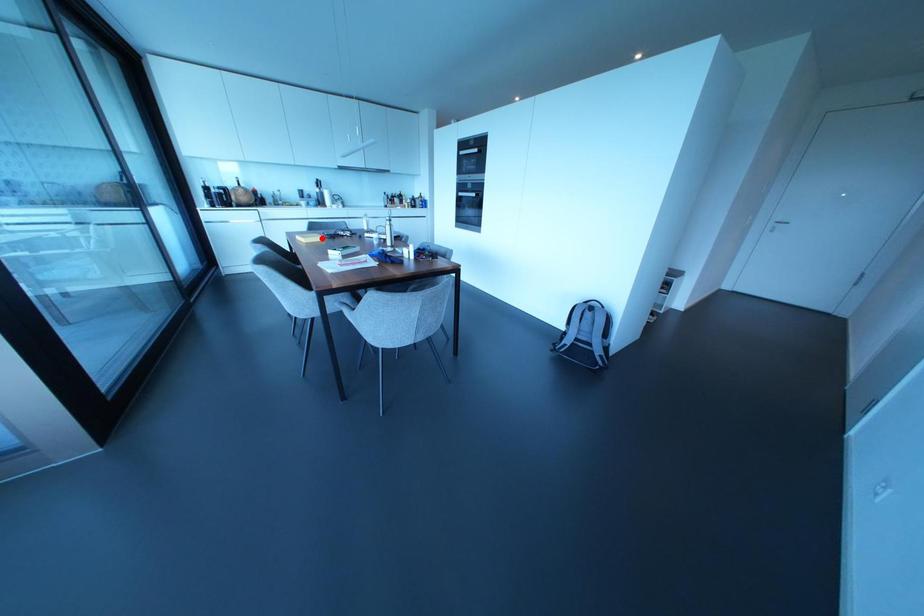
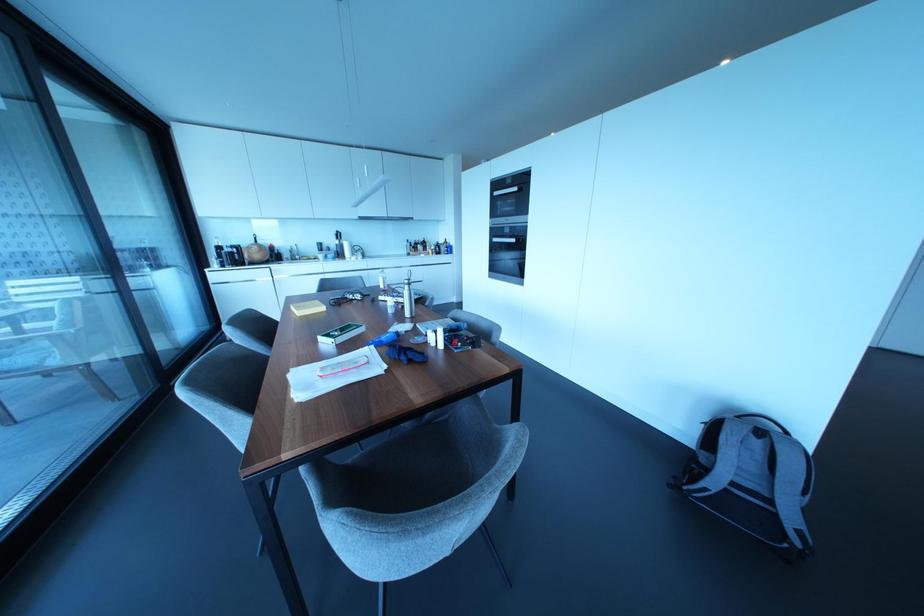
Where in the second image is the point corresponding to the highlighted location from the first image?

(322, 308)